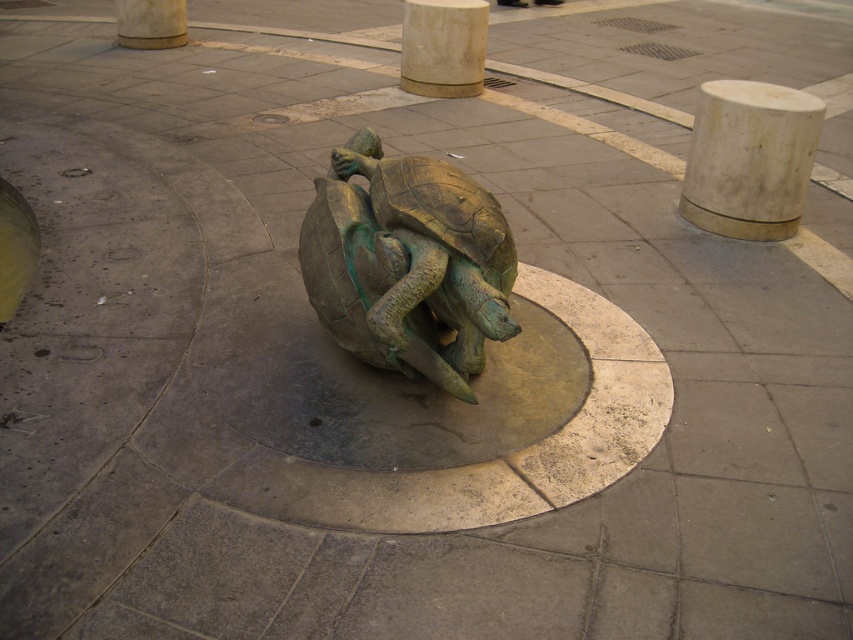
Question: Where is white marble pillar at upper right located in relation to white marble pillar at center in the image?

Choices:
 (A) above
 (B) below

Answer: (B)

Question: Is green patina turtle at center bigger than white marble pillar at upper right?

Choices:
 (A) no
 (B) yes

Answer: (B)

Question: Considering the real-world distances, which object is closest to the white marble pillar at upper right?

Choices:
 (A) smooth beige pillar at upper center
 (B) white marble pillar at center
 (C) green patina turtle at center

Answer: (C)

Question: Does white marble pillar at upper right have a lesser width compared to smooth beige pillar at upper center?

Choices:
 (A) yes
 (B) no

Answer: (B)

Question: Which point is closer to the camera taking this photo?

Choices:
 (A) (456, 4)
 (B) (447, 221)
 (C) (164, 10)

Answer: (B)

Question: Which is farther from the white marble pillar at upper right?

Choices:
 (A) smooth beige pillar at upper center
 (B) white marble pillar at center

Answer: (A)